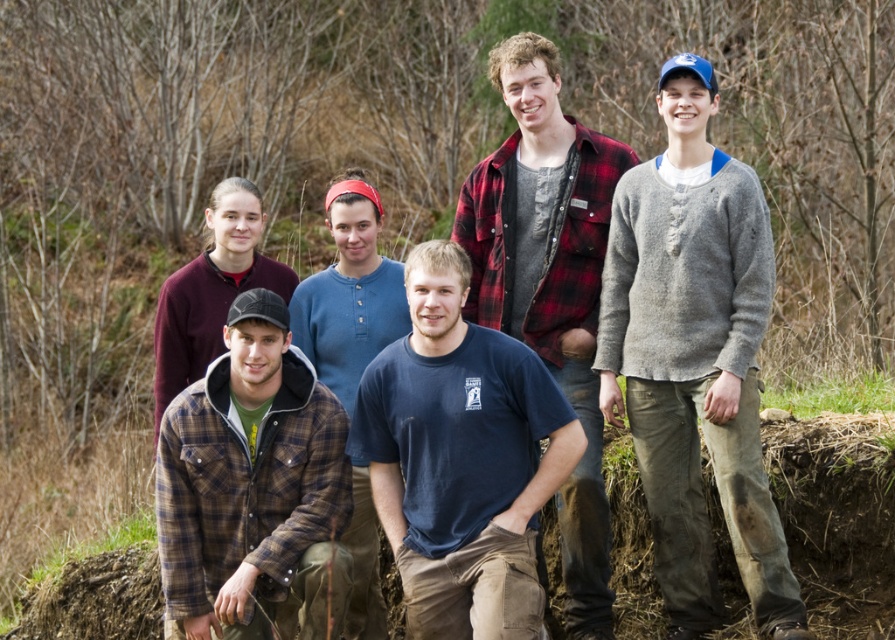
You are standing at the viewpoint and want to know how far the point at coordinate point (212, 570) is from you. Can you determine the distance?

The distance between the point at coordinate point (212, 570) and the viewer is 6.69 meters.